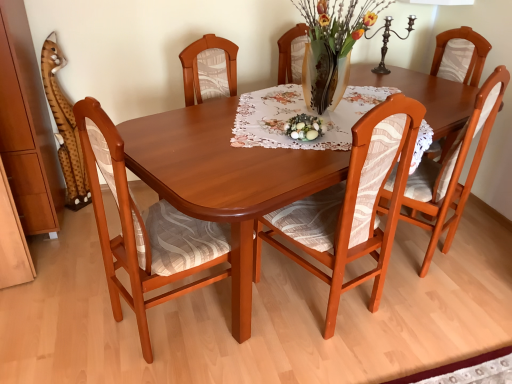
Question: Considering the relative positions of matte green glass bowl at center and matte wood chair at center, positioned as the 2th chair in left-to-right order, in the image provided, is matte green glass bowl at center to the left of matte wood chair at center, positioned as the 2th chair in left-to-right order, from the viewer's perspective?

Choices:
 (A) yes
 (B) no

Answer: (A)

Question: From the image's perspective, is matte green glass bowl at center on matte wood chair at center, the 2th chair from the right?

Choices:
 (A) yes
 (B) no

Answer: (A)

Question: From a real-world perspective, does matte green glass bowl at center sit lower than matte wood chair at center, positioned as the 2th chair in left-to-right order?

Choices:
 (A) no
 (B) yes

Answer: (A)

Question: Is matte green glass bowl at center in contact with matte wood chair at center, the 2th chair from the right?

Choices:
 (A) yes
 (B) no

Answer: (B)

Question: Considering the relative positions of matte green glass bowl at center and matte wood chair at center, the 2th chair from the right, in the image provided, is matte green glass bowl at center in front of matte wood chair at center, the 2th chair from the right,?

Choices:
 (A) no
 (B) yes

Answer: (A)

Question: Considering their positions, is shiny wood table at center located in front of or behind wooden chair at left, marked as the first chair in a left-to-right arrangement?

Choices:
 (A) front
 (B) behind

Answer: (A)

Question: Visually, is shiny wood table at center positioned to the left or to the right of wooden chair at left, marked as the first chair in a left-to-right arrangement?

Choices:
 (A) left
 (B) right

Answer: (B)

Question: Considering the positions of point (187, 213) and point (170, 216), is point (187, 213) closer or farther from the camera than point (170, 216)?

Choices:
 (A) closer
 (B) farther

Answer: (A)

Question: Is shiny wood table at center wider or thinner than wooden chair at left, marked as the first chair in a left-to-right arrangement?

Choices:
 (A) wide
 (B) thin

Answer: (A)

Question: Considering the positions of matte green glass bowl at center and matte wood chair at center, acting as the third chair starting from the left, in the image, is matte green glass bowl at center bigger or smaller than matte wood chair at center, acting as the third chair starting from the left,?

Choices:
 (A) small
 (B) big

Answer: (A)

Question: Does point (296, 119) appear closer or farther from the camera than point (389, 188)?

Choices:
 (A) closer
 (B) farther

Answer: (B)

Question: Is matte green glass bowl at center inside or outside of matte wood chair at center, acting as the third chair starting from the left?

Choices:
 (A) outside
 (B) inside

Answer: (A)

Question: From a real-world perspective, relative to matte wood chair at center, acting as the third chair starting from the left, is matte green glass bowl at center vertically above or below?

Choices:
 (A) below
 (B) above

Answer: (B)

Question: In the image, is matte wood chair at center, acting as the third chair starting from the left, positioned in front of or behind matte wood chair at center, positioned as the 2th chair in left-to-right order?

Choices:
 (A) behind
 (B) front

Answer: (A)

Question: Choose the correct answer: Is matte wood chair at center, arranged as the first chair when viewed from the right, inside matte wood chair at center, the 2th chair from the right, or outside it?

Choices:
 (A) inside
 (B) outside

Answer: (B)